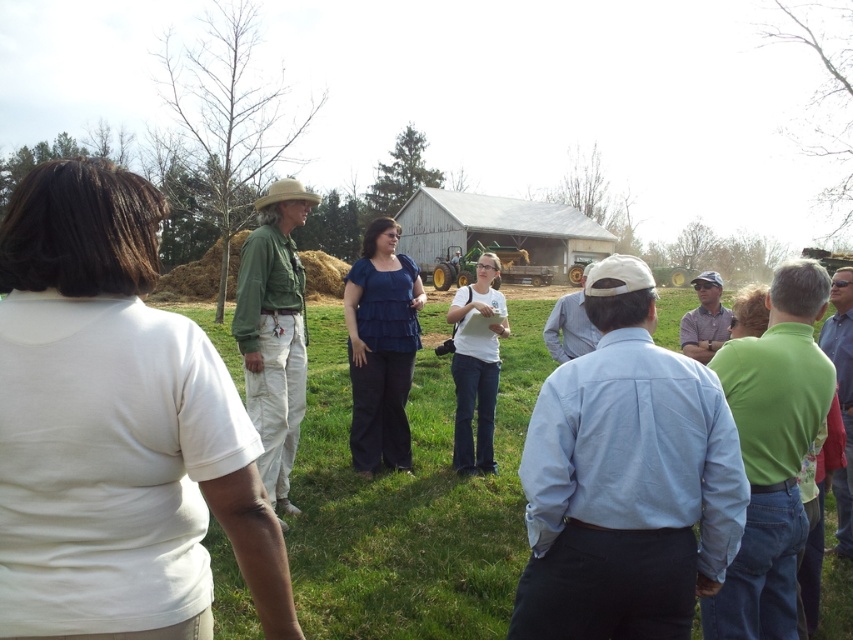
Question: Can you confirm if green cotton shirt at center is positioned above white cotton shirt at center?

Choices:
 (A) yes
 (B) no

Answer: (A)

Question: Which of these objects is positioned closest to the blue fabric blouse at center?

Choices:
 (A) white cotton shirt at center
 (B) green cotton shirt at center
 (C) green grass at center

Answer: (A)

Question: Which object appears closest to the camera in this image?

Choices:
 (A) green cotton shirt at center
 (B) green grass at center

Answer: (B)

Question: Which object is farther from the camera taking this photo?

Choices:
 (A) blue fabric blouse at center
 (B) white cotton shirt at center

Answer: (B)

Question: Is the position of green cotton shirt at center less distant than that of white cotton shirt at center?

Choices:
 (A) yes
 (B) no

Answer: (A)

Question: Is green cotton shirt at center further to camera compared to blue fabric blouse at center?

Choices:
 (A) yes
 (B) no

Answer: (B)